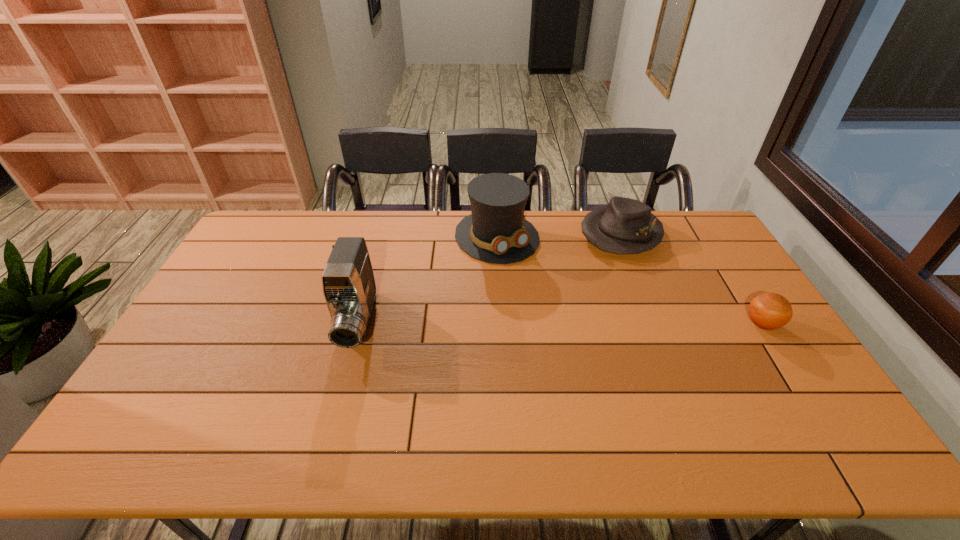
At what (x,y) coordinates should I click in order to perform the action: click on empty space between the leftmost object and the orange. Please return your answer as a coordinate pair (x, y). Image resolution: width=960 pixels, height=540 pixels. Looking at the image, I should click on (560, 323).

This screenshot has height=540, width=960. I want to click on vacant area between the rightmost object and the camcorder, so click(x=560, y=323).

Locate an element on the screen. This screenshot has width=960, height=540. blank region between the dress hat and the hat is located at coordinates (x=559, y=235).

Find the location of a particular element. This screenshot has height=540, width=960. free spot between the dress hat and the hat is located at coordinates (559, 235).

Where is `vacant area that lies between the orange and the second object from left to right`? vacant area that lies between the orange and the second object from left to right is located at coordinates (630, 280).

This screenshot has height=540, width=960. I want to click on empty space between the second object from right to left and the rightmost object, so click(x=691, y=279).

Identify the location of free area in between the leftmost object and the orange. (560, 323).

The height and width of the screenshot is (540, 960). I want to click on empty location between the third object from left to right and the rightmost object, so click(691, 279).

In order to click on free space that is in between the third object from left to right and the leftmost object in this screenshot , I will do `click(490, 279)`.

Find the location of a particular element. The height and width of the screenshot is (540, 960). vacant space in between the orange and the hat is located at coordinates (691, 279).